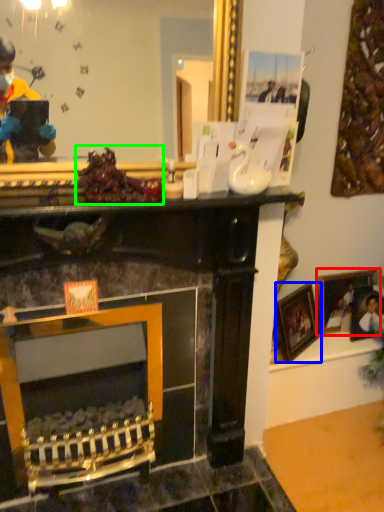
Question: Which object is the closest to the picture frame (highlighted by a red box)? Choose among these: picture frame (highlighted by a blue box) or food (highlighted by a green box).

Choices:
 (A) picture frame
 (B) food

Answer: (A)